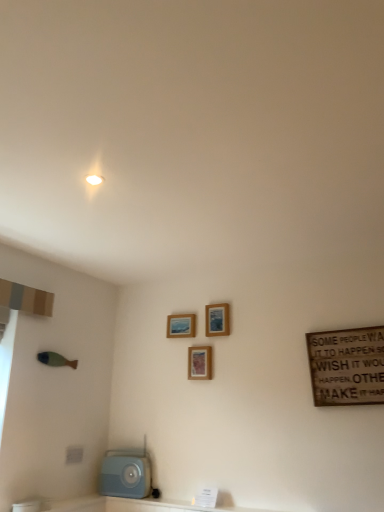
Question: Is wooden picture frame at upper center, the third picture frame from the right, in contact with wooden picture frame at upper center, the 3th picture frame positioned from the left?

Choices:
 (A) no
 (B) yes

Answer: (A)

Question: Is wooden picture frame at upper center, the first picture frame viewed from the left, positioned before wooden picture frame at upper center, the 3th picture frame positioned from the left?

Choices:
 (A) yes
 (B) no

Answer: (B)

Question: From the image's perspective, would you say wooden picture frame at upper center, the first picture frame viewed from the left, is shown under wooden picture frame at upper center, the 3th picture frame positioned from the left?

Choices:
 (A) no
 (B) yes

Answer: (B)

Question: Is wooden picture frame at upper center, the first picture frame viewed from the left, facing away from wooden picture frame at upper center, which ranks as the 1th picture frame in right-to-left order?

Choices:
 (A) no
 (B) yes

Answer: (A)

Question: Is wooden picture frame at upper center, the first picture frame viewed from the left, to the left of wooden picture frame at upper center, the 3th picture frame positioned from the left, from the viewer's perspective?

Choices:
 (A) yes
 (B) no

Answer: (A)

Question: Is light blue plastic radio at lower left spatially inside wooden signboard at right, or outside of it?

Choices:
 (A) outside
 (B) inside

Answer: (A)

Question: In the image, is light blue plastic radio at lower left on the left side or the right side of wooden signboard at right?

Choices:
 (A) left
 (B) right

Answer: (A)

Question: From their relative heights in the image, would you say light blue plastic radio at lower left is taller or shorter than wooden signboard at right?

Choices:
 (A) tall
 (B) short

Answer: (B)

Question: From a real-world perspective, relative to wooden signboard at right, is light blue plastic radio at lower left vertically above or below?

Choices:
 (A) above
 (B) below

Answer: (B)

Question: In terms of size, does wooden signboard at right appear bigger or smaller than wooden picture frame at upper center, the 3th picture frame positioned from the left?

Choices:
 (A) big
 (B) small

Answer: (A)

Question: From a real-world perspective, is wooden signboard at right physically located above or below wooden picture frame at upper center, which ranks as the 1th picture frame in right-to-left order?

Choices:
 (A) above
 (B) below

Answer: (B)

Question: Based on their positions, is wooden signboard at right located to the left or right of wooden picture frame at upper center, the 3th picture frame positioned from the left?

Choices:
 (A) left
 (B) right

Answer: (B)

Question: In terms of height, does wooden signboard at right look taller or shorter compared to wooden picture frame at upper center, which ranks as the 1th picture frame in right-to-left order?

Choices:
 (A) short
 (B) tall

Answer: (B)

Question: Considering the positions of point pyautogui.click(x=314, y=379) and point pyautogui.click(x=185, y=324), is point pyautogui.click(x=314, y=379) closer or farther from the camera than point pyautogui.click(x=185, y=324)?

Choices:
 (A) farther
 (B) closer

Answer: (B)

Question: Considering their positions, is wooden signboard at right located in front of or behind wooden picture frame at upper center, the first picture frame viewed from the left?

Choices:
 (A) front
 (B) behind

Answer: (A)